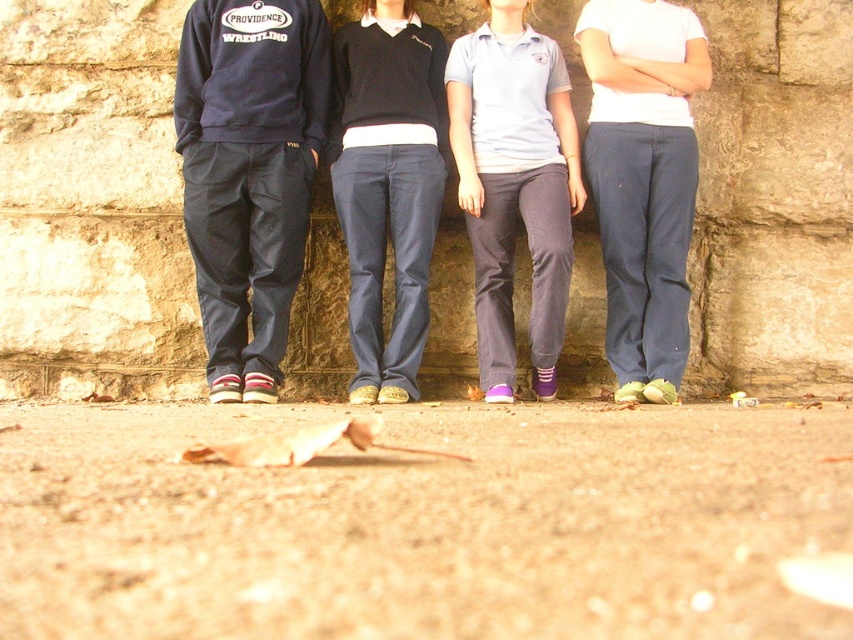
Is stone at center positioned behind dark blue cotton pants at left?

Yes, it is behind dark blue cotton pants at left.

Is point (741, 182) farther from camera compared to point (273, 8)?

That is True.

Identify the location of stone at center. (91, 202).

Can you confirm if stone at center is bigger than dark blue denim pants at center?

No.

Is stone at center taller than dark blue denim pants at center?

Yes, stone at center is taller than dark blue denim pants at center.

Describe the element at coordinates (91, 202) in the screenshot. Image resolution: width=853 pixels, height=640 pixels. I see `stone at center` at that location.

You are a GUI agent. You are given a task and a screenshot of the screen. Output one action in this format:
    pyautogui.click(x=<x>, y=<y>)
    Task: Click on the stone at center
    This screenshot has width=853, height=640.
    Given the screenshot: What is the action you would take?
    tap(91, 202)

Between point (289, 284) and point (540, 257), which one is positioned in front?

Point (540, 257) is in front.

Is dark blue cotton pants at left positioned in front of gray cotton pants at center?

That is True.

I want to click on dark blue cotton pants at left, so pos(248,173).